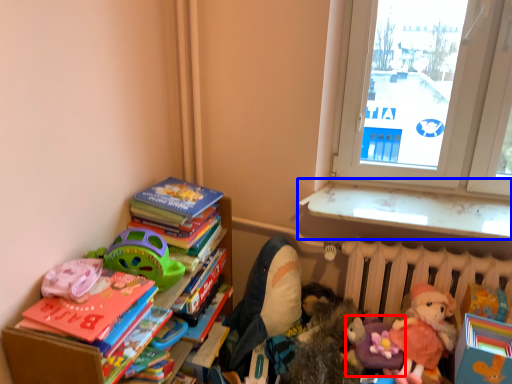
Question: Which object appears closest to the camera in this image, toy (highlighted by a red box) or window sill (highlighted by a blue box)?

Choices:
 (A) toy
 (B) window sill

Answer: (A)